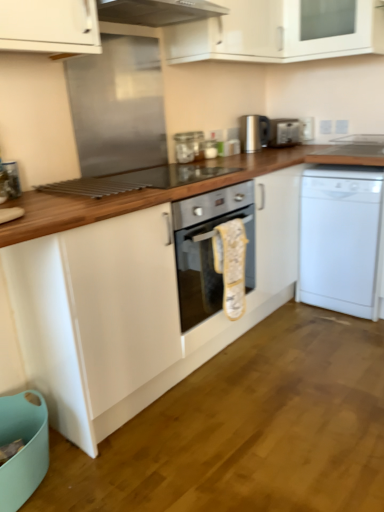
Question: Can you confirm if white matte dishwasher at right is wider than wooden at center?

Choices:
 (A) yes
 (B) no

Answer: (B)

Question: Is white matte dishwasher at right not near wooden at center?

Choices:
 (A) no
 (B) yes

Answer: (A)

Question: Could you tell me if white matte dishwasher at right is facing wooden at center?

Choices:
 (A) yes
 (B) no

Answer: (A)

Question: From the image's perspective, is white matte dishwasher at right on top of wooden at center?

Choices:
 (A) yes
 (B) no

Answer: (A)

Question: Does white matte dishwasher at right have a lesser width compared to wooden at center?

Choices:
 (A) yes
 (B) no

Answer: (A)

Question: Is white glossy cabinet at upper center, which appears as the 2th cabinetry when viewed from the left, in front of or behind satin silver kettle at upper center, the 2th appliance positioned from the right, in the image?

Choices:
 (A) front
 (B) behind

Answer: (A)

Question: In terms of size, does white glossy cabinet at upper center, which appears as the 2th cabinetry when viewed from the left, appear bigger or smaller than satin silver kettle at upper center, the 2th appliance positioned from the right?

Choices:
 (A) big
 (B) small

Answer: (A)

Question: Is white glossy cabinet at upper center, placed as the 1th cabinetry when sorted from right to left, taller or shorter than satin silver kettle at upper center, the first appliance in the left-to-right sequence?

Choices:
 (A) short
 (B) tall

Answer: (B)

Question: Is point (284, 7) positioned closer to the camera than point (244, 139)?

Choices:
 (A) closer
 (B) farther

Answer: (A)

Question: From their relative heights in the image, would you say white glossy cabinet at upper center, the second cabinetry positioned from the right, is taller or shorter than white glossy cabinet at upper center, placed as the 1th cabinetry when sorted from right to left?

Choices:
 (A) short
 (B) tall

Answer: (B)

Question: From a real-world perspective, is white glossy cabinet at upper center, the second cabinetry positioned from the right, above or below white glossy cabinet at upper center, which appears as the 2th cabinetry when viewed from the left?

Choices:
 (A) above
 (B) below

Answer: (A)

Question: Considering their positions, is white glossy cabinet at upper center, the second cabinetry positioned from the right, located in front of or behind white glossy cabinet at upper center, which appears as the 2th cabinetry when viewed from the left?

Choices:
 (A) front
 (B) behind

Answer: (A)

Question: Looking at their shapes, would you say white glossy cabinet at upper center, which ranks as the first cabinetry in left-to-right order, is wider or thinner than white glossy cabinet at upper center, placed as the 1th cabinetry when sorted from right to left?

Choices:
 (A) thin
 (B) wide

Answer: (B)

Question: Is point (355, 169) closer or farther from the camera than point (183, 51)?

Choices:
 (A) farther
 (B) closer

Answer: (A)

Question: In terms of size, does white matte dishwasher at right appear bigger or smaller than white glossy cabinet at upper center, the second cabinetry positioned from the right?

Choices:
 (A) big
 (B) small

Answer: (B)